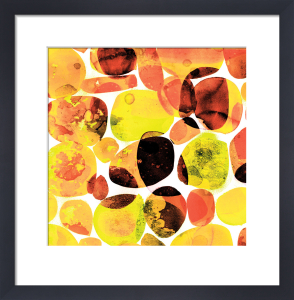
Find the location of a particular element. The image size is (294, 300). frame is located at coordinates (6, 110), (111, 9), (285, 179), (110, 290).